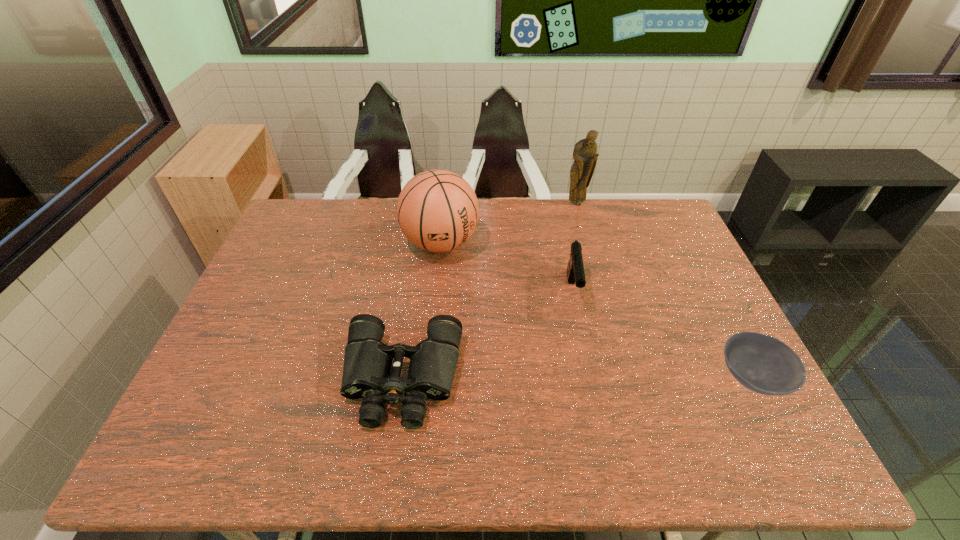
I want to click on vacant space on the desktop that is between the fourth tallest object and the rightmost object and is positioned on the front-facing side of the farthest object, so click(x=583, y=379).

Find the location of `free space on the desktop that is between the second shortest object and the shortest object and is positioned on the surface of the basketball near the brand logo`. free space on the desktop that is between the second shortest object and the shortest object and is positioned on the surface of the basketball near the brand logo is located at coordinates pyautogui.click(x=532, y=379).

The image size is (960, 540). I want to click on vacant space on the desktop that is between the binoculars and the shortest object and is positioned at the barrel of the pistol, so click(582, 379).